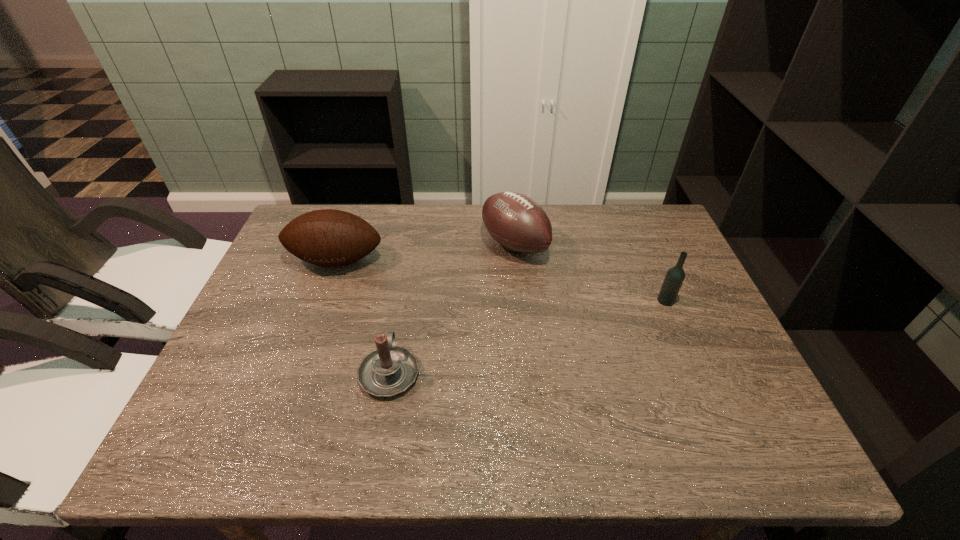
Find the location of `object that stands as the closest to the right football`. object that stands as the closest to the right football is located at coordinates (327, 237).

I want to click on the closest object relative to the right football, so click(327, 237).

The height and width of the screenshot is (540, 960). Identify the location of blank space that satisfies the following two spatial constraints: 1. on the laces of the left football; 2. on the right side of the rightmost object. (322, 301).

Where is `blank area in the image that satisfies the following two spatial constraints: 1. on the side of the nearest object with the handle loop; 2. on the right side of the rightmost object`? This screenshot has width=960, height=540. blank area in the image that satisfies the following two spatial constraints: 1. on the side of the nearest object with the handle loop; 2. on the right side of the rightmost object is located at coordinates (402, 301).

The width and height of the screenshot is (960, 540). Find the location of `vacant space that satisfies the following two spatial constraints: 1. on the laces of the leftmost object; 2. on the left side of the vodka`. vacant space that satisfies the following two spatial constraints: 1. on the laces of the leftmost object; 2. on the left side of the vodka is located at coordinates (322, 301).

Locate an element on the screen. The height and width of the screenshot is (540, 960). free spot that satisfies the following two spatial constraints: 1. on the side of the second object from right to left with the handle loop; 2. on the left side of the candle is located at coordinates [x=413, y=245].

The image size is (960, 540). I want to click on free point that satisfies the following two spatial constraints: 1. on the laces of the leftmost object; 2. on the right side of the second nearest object, so click(322, 301).

This screenshot has height=540, width=960. In order to click on free space in the image that satisfies the following two spatial constraints: 1. on the side of the right football with the handle loop; 2. on the right side of the nearest object in this screenshot , I will do `click(413, 245)`.

At what (x,y) coordinates should I click in order to perform the action: click on blank space that satisfies the following two spatial constraints: 1. on the side of the shortest object with the handle loop; 2. on the left side of the vodka. Please return your answer as a coordinate pair (x, y). Image resolution: width=960 pixels, height=540 pixels. Looking at the image, I should click on (402, 301).

The image size is (960, 540). I want to click on free space that satisfies the following two spatial constraints: 1. on the side of the shortest object with the handle loop; 2. on the right side of the second object from right to left, so click(x=413, y=245).